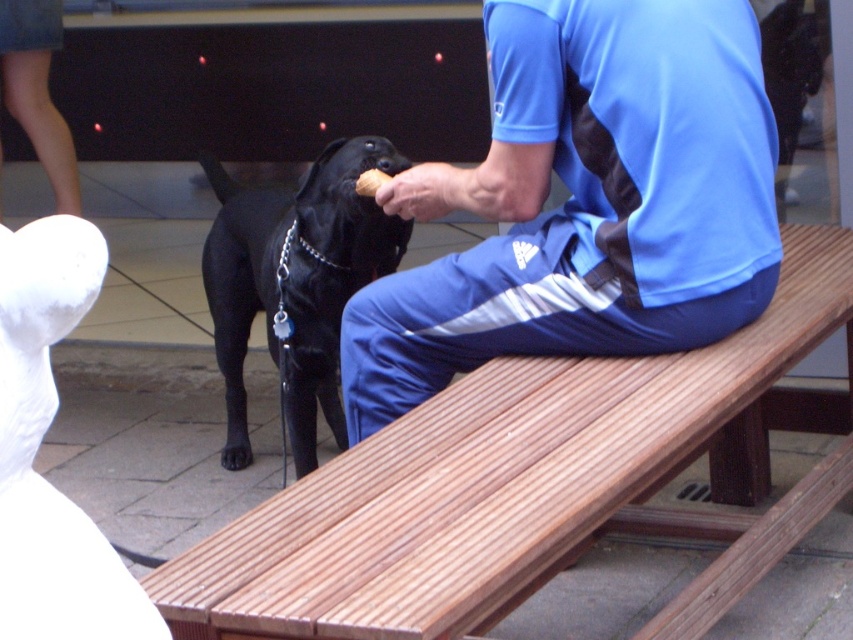
You are standing at the origin of the coordinate system in the image. You see the point at coordinates (x=585, y=202). Which object from the following list is this point located on? The options are the wooden bench, the black dog, or the blue fabric shirt at upper right.

The point at coordinates (x=585, y=202) is located on the blue fabric shirt at upper right.